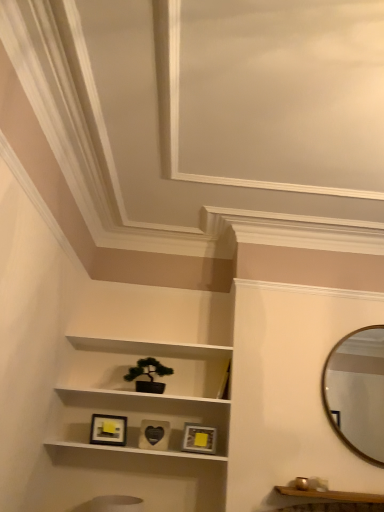
Locate an element on the screen. vacant area on top of wooden shelf at lower right (from a real-world perspective) is located at coordinates (334, 493).